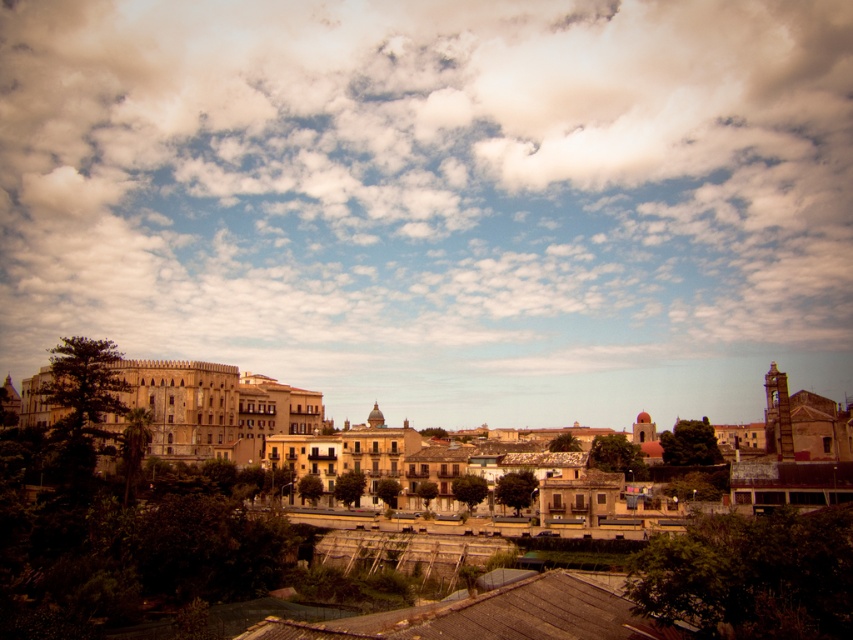
Question: Can you confirm if cloudy sky at upper center is thinner than brown stone buildings at left?

Choices:
 (A) yes
 (B) no

Answer: (B)

Question: Which point is farther from the camera taking this photo?

Choices:
 (A) (149, 404)
 (B) (775, 164)

Answer: (B)

Question: Is cloudy sky at upper center below brown stone buildings at left?

Choices:
 (A) yes
 (B) no

Answer: (B)

Question: Among these points, which one is nearest to the camera?

Choices:
 (A) (155, 61)
 (B) (167, 380)

Answer: (B)

Question: Can you confirm if cloudy sky at upper center is wider than brown stone buildings at left?

Choices:
 (A) no
 (B) yes

Answer: (B)